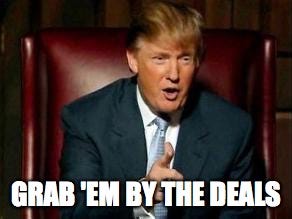
Where is `brown wooded wall`? brown wooded wall is located at coordinates click(86, 23), click(109, 14), click(227, 18), click(11, 135).